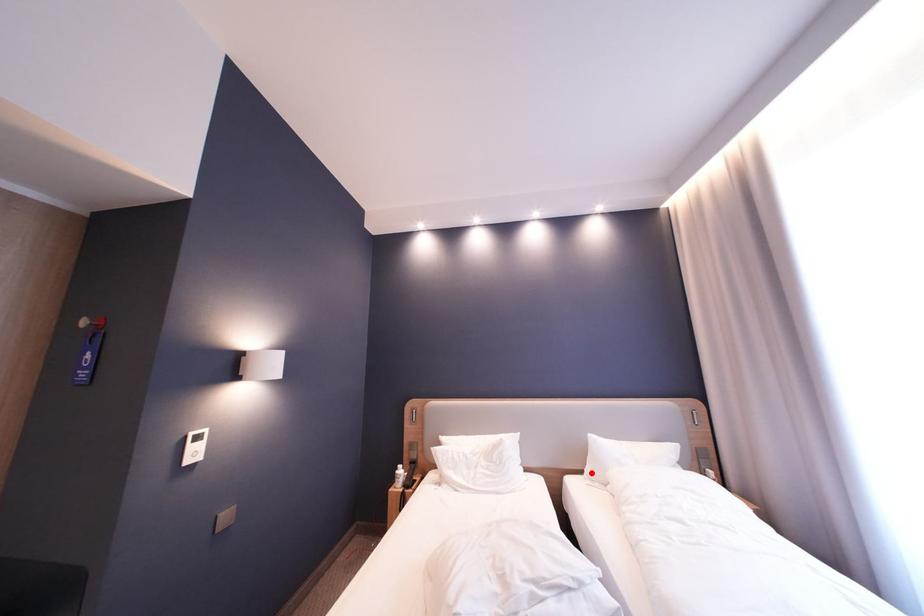
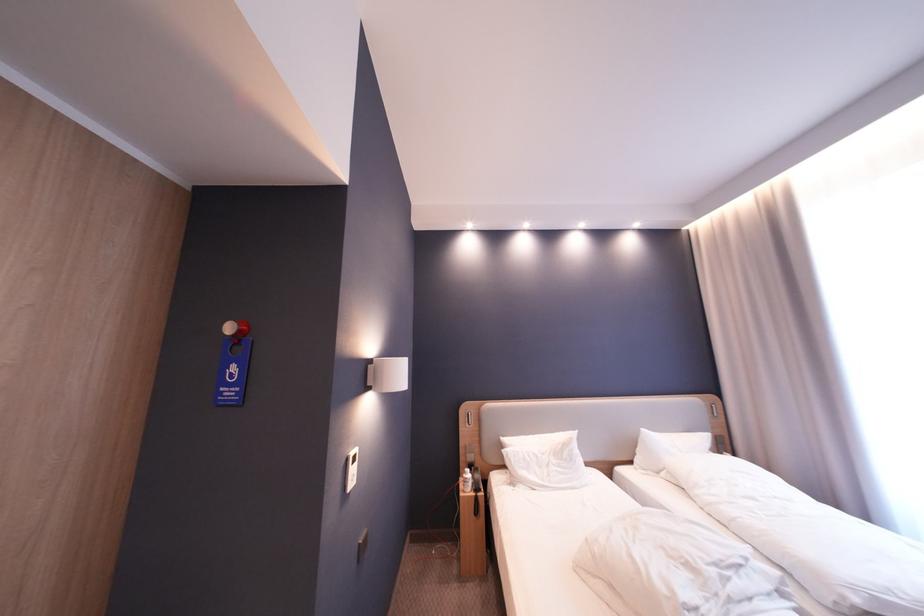
Question: I am providing you with two images of the same scene from different viewpoints. Given a red point in image1, look at the same physical point in image2. Is it:

Choices:
 (A) Closer to the viewpoint
 (B) Farther from the viewpoint

Answer: (A)